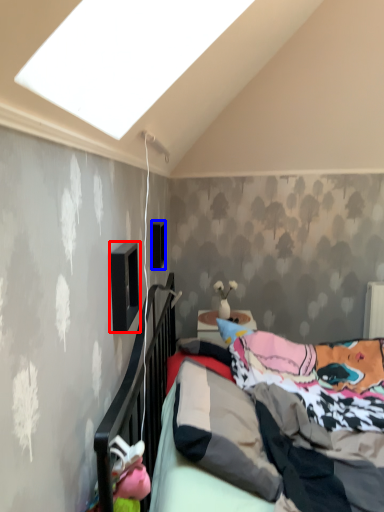
Question: Which object is closer to the camera taking this photo, window (highlighted by a red box) or window (highlighted by a blue box)?

Choices:
 (A) window
 (B) window

Answer: (A)